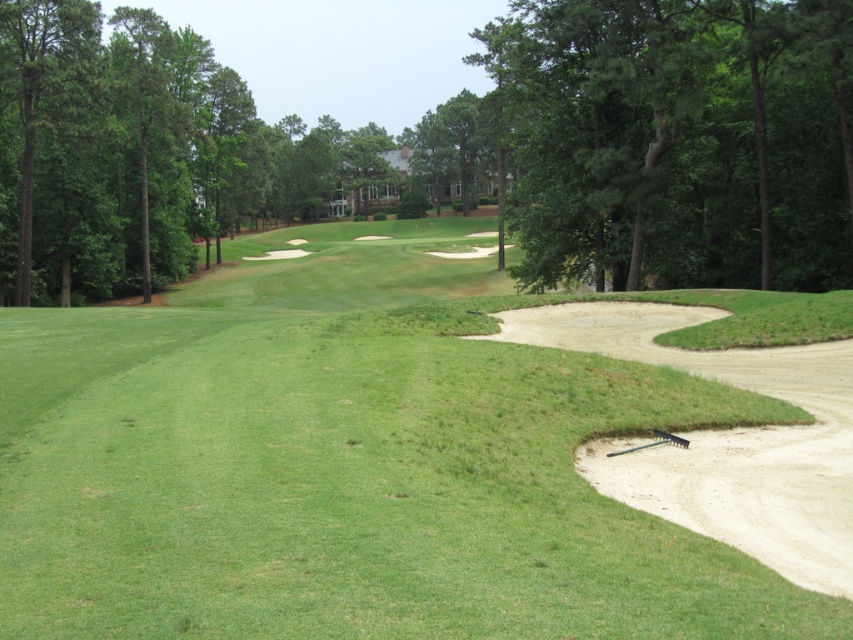
You are a golfer standing at the tee, looking at the fairway. You notice two points marked on the golf course. One is at coordinates point (676, 625) and the other is at point (712, 45). Which point is closer to your current position?

Point (676, 625) is closer to the camera than point (712, 45), so the point at coordinates point (676, 625) is closer to your current position.

You are a golfer standing on the green grassy golf course at center and want to hit the ball towards the green leafy tree at upper center. Based on the scene description, will the tree be visible from your current position?

The green grassy golf course at center is closer to the viewer than the green leafy tree at upper center, so yes, the tree will be visible from your current position as it is in the background but still within sight.

You are a golfer standing at the tee and want to hit your ball to the green grassy golf course at center. Based on the coordinates provided, in which direction should you aim relative to your current position?

The green grassy golf course at center is located at coordinates point (349, 465), which means you should aim slightly to the right and forward from your current position at the tee.